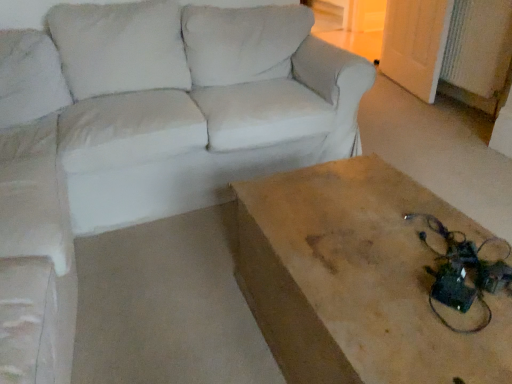
Locate an element on the screen. vacant space situated above wooden table at center (from a real-world perspective) is located at coordinates (402, 254).